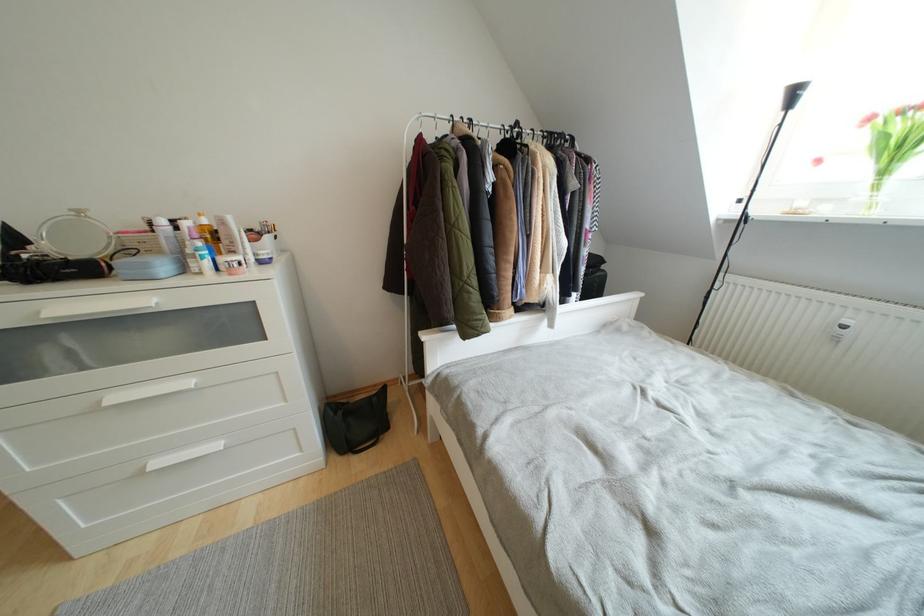
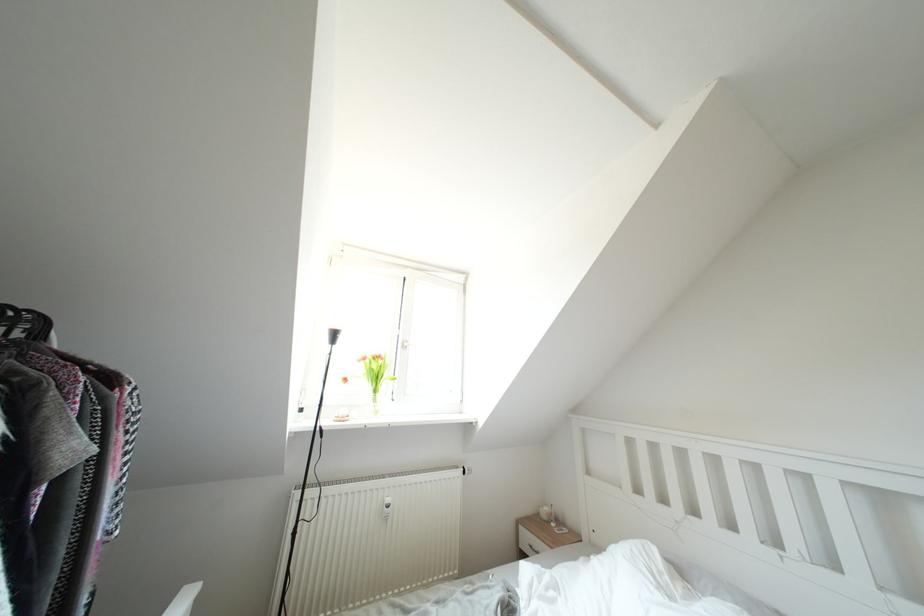
The point at (x=877, y=122) is marked in the first image. Where is the corresponding point in the second image?

(370, 363)